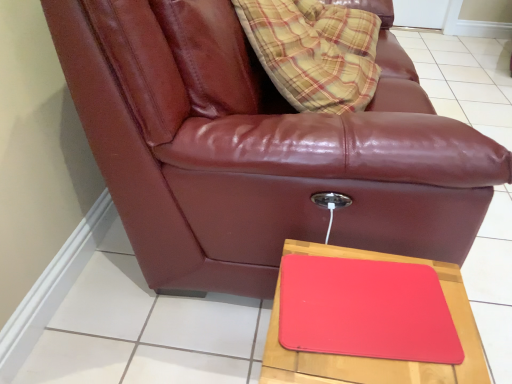
Question: In terms of size, does rubberized red tray at lower right appear bigger or smaller than matte leather couch at center?

Choices:
 (A) small
 (B) big

Answer: (A)

Question: From the image's perspective, relative to matte leather couch at center, is rubberized red tray at lower right above or below?

Choices:
 (A) above
 (B) below

Answer: (B)

Question: Considering the relative positions of rubberized red tray at lower right and matte leather couch at center in the image provided, is rubberized red tray at lower right to the left or to the right of matte leather couch at center?

Choices:
 (A) right
 (B) left

Answer: (A)

Question: Visually, is matte leather couch at center positioned to the left or to the right of rubberized red tray at lower right?

Choices:
 (A) right
 (B) left

Answer: (B)

Question: Considering their positions, is matte leather couch at center located in front of or behind rubberized red tray at lower right?

Choices:
 (A) behind
 (B) front

Answer: (A)

Question: Is matte leather couch at center situated inside rubberized red tray at lower right or outside?

Choices:
 (A) inside
 (B) outside

Answer: (B)

Question: From a real-world perspective, is matte leather couch at center above or below rubberized red tray at lower right?

Choices:
 (A) above
 (B) below

Answer: (A)